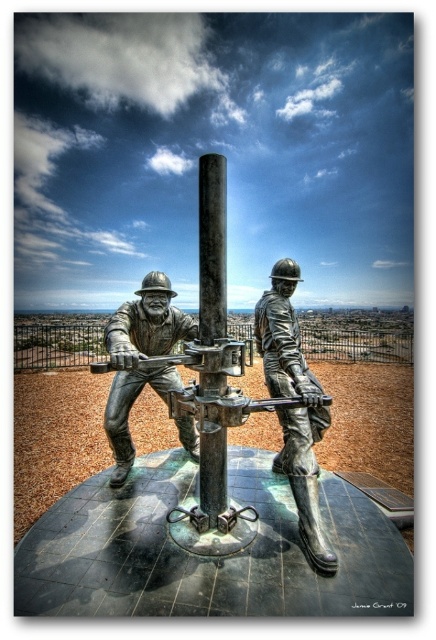
Where is `bronze statue of man at center`? This screenshot has width=436, height=640. bronze statue of man at center is located at coordinates (140, 358).

Does point (170, 336) come closer to viewer compared to point (162, 356)?

No, it is behind (162, 356).

Where is `bronze statue of man at center`? bronze statue of man at center is located at coordinates (140, 358).

Measure the distance between brushed metal statue at center and polished bronze rifle at center.

A distance of 5.63 feet exists between brushed metal statue at center and polished bronze rifle at center.

Is point (292, 336) farther from camera compared to point (102, 365)?

Yes, point (292, 336) is behind point (102, 365).

This screenshot has height=640, width=436. What are the coordinates of `brushed metal statue at center` in the screenshot? It's located at (293, 406).

The width and height of the screenshot is (436, 640). Describe the element at coordinates (245, 397) in the screenshot. I see `bronze/statue at center` at that location.

Which is above, bronze/statue at center or bronze statue of man at center?

Positioned higher is bronze statue of man at center.

Between point (334, 563) and point (113, 362), which one is positioned in front?

Point (334, 563) is more forward.

The image size is (436, 640). I want to click on bronze/statue at center, so click(x=245, y=397).